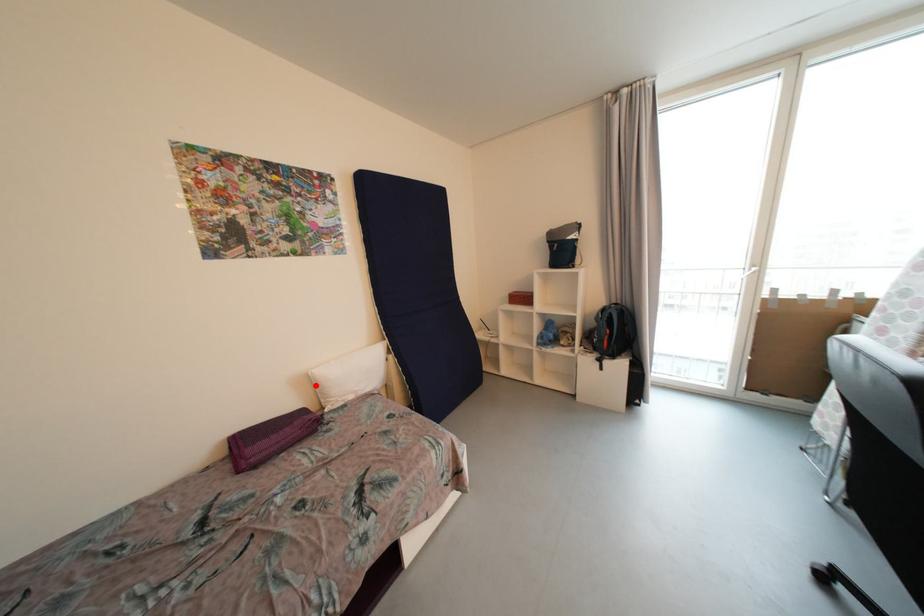
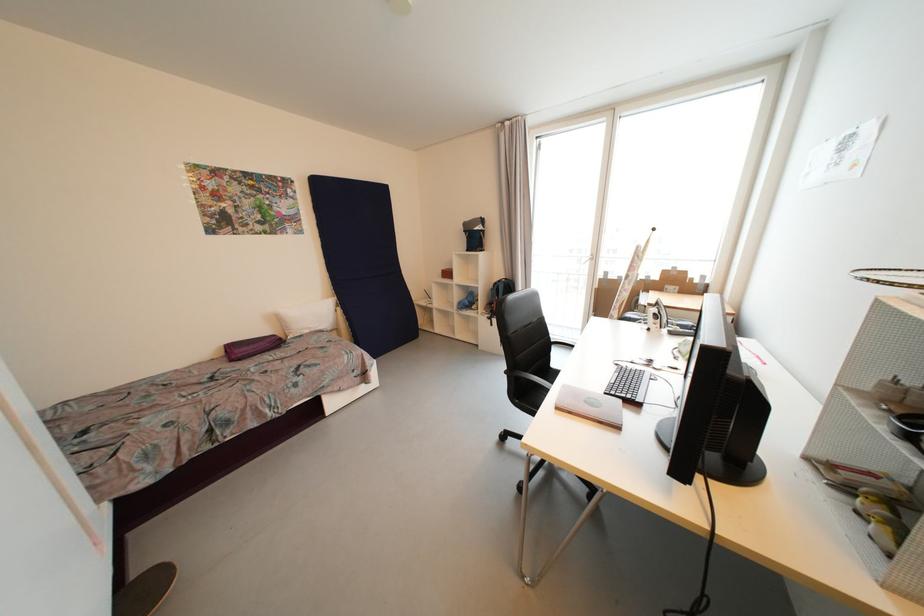
Where in the second image is the point corresponding to the highlighted location from the first image?

(283, 321)